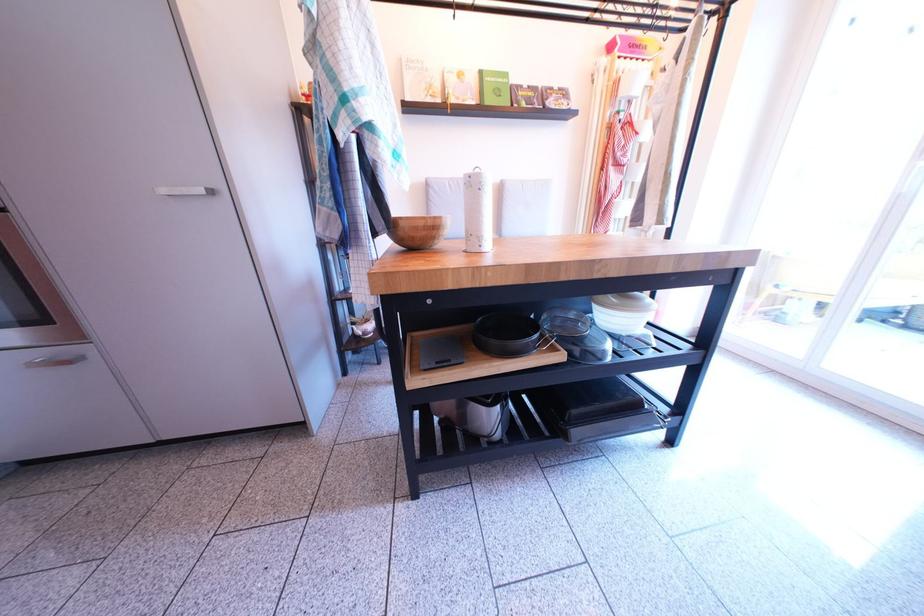
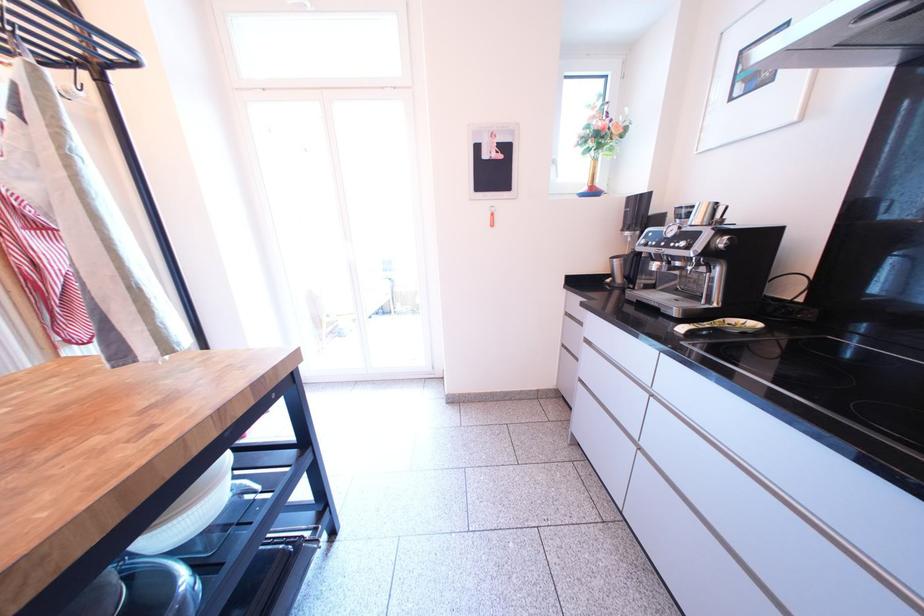
Question: The camera is either moving clockwise (left) or counter-clockwise (right) around the object. The first image is from the beginning of the video and the second image is from the end. Is the camera moving left or right when shooting the video?

Choices:
 (A) Left
 (B) Right

Answer: (A)